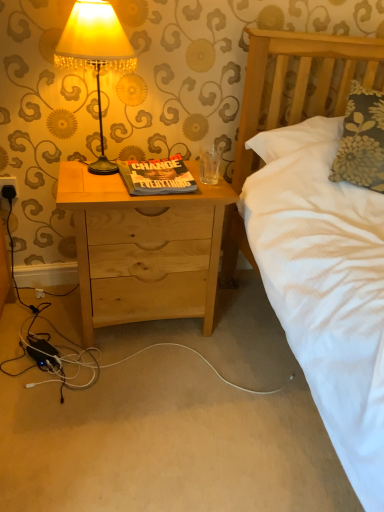
Question: In terms of height, does natural wood nightstand at center look taller or shorter compared to black plastic electric outlet at lower left?

Choices:
 (A) tall
 (B) short

Answer: (A)

Question: From a real-world perspective, is natural wood nightstand at center physically located above or below black plastic electric outlet at lower left?

Choices:
 (A) above
 (B) below

Answer: (B)

Question: Which is farther from the black plastic electric outlet at lower left?

Choices:
 (A) natural wood nightstand at center
 (B) matte yellow fabric lampshade at upper left

Answer: (A)

Question: Which object is positioned farthest from the black plastic electric outlet at lower left?

Choices:
 (A) natural wood nightstand at center
 (B) matte yellow fabric lampshade at upper left

Answer: (A)